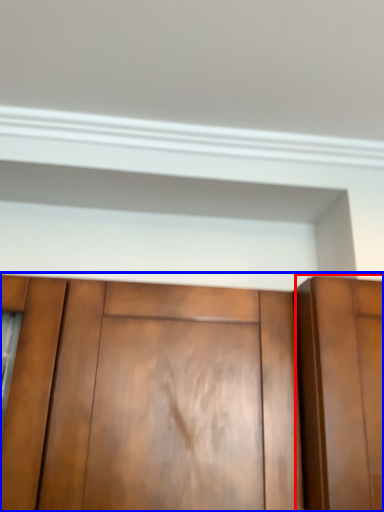
Question: Among these objects, which one is farthest to the camera, door (highlighted by a red box) or cupboard (highlighted by a blue box)?

Choices:
 (A) door
 (B) cupboard

Answer: (B)